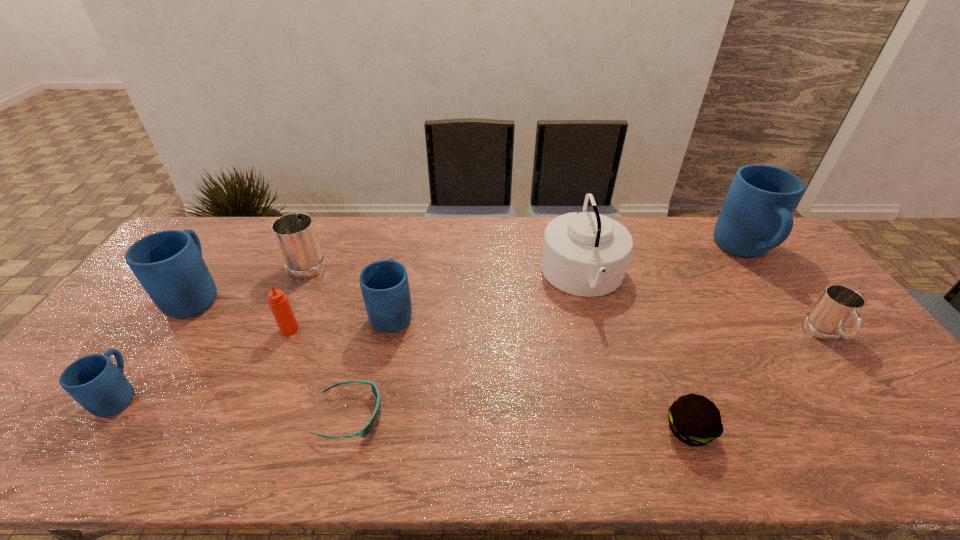
You are a GUI agent. You are given a task and a screenshot of the screen. Output one action in this format:
    pyautogui.click(x=<x>, y=<y>)
    Task: Click on the smaller gray mug
    
    Given the screenshot: What is the action you would take?
    pyautogui.click(x=838, y=305)

The image size is (960, 540). Identify the location of the smallest blue mug. (94, 381).

You are a GUI agent. You are given a task and a screenshot of the screen. Output one action in this format:
    pyautogui.click(x=<x>, y=<y>)
    Task: Click on the nearest blue mug
    
    Given the screenshot: What is the action you would take?
    pyautogui.click(x=94, y=381)

What are the coordinates of `patty` in the screenshot? It's located at (695, 420).

This screenshot has width=960, height=540. I want to click on the shortest object, so click(368, 428).

The image size is (960, 540). Find the location of `sunglasses`. sunglasses is located at coordinates (368, 428).

This screenshot has height=540, width=960. I want to click on vacant position located 0.310m on the side of the biggest blue mug with the handle, so click(818, 355).

Identify the location of vacant space positioned 0.150m on the spout of the kettle. (495, 276).

Identify the location of vacant position located on the spout of the kettle. The image size is (960, 540). (429, 276).

The height and width of the screenshot is (540, 960). I want to click on vacant space located 0.160m on the spout of the kettle, so click(492, 276).